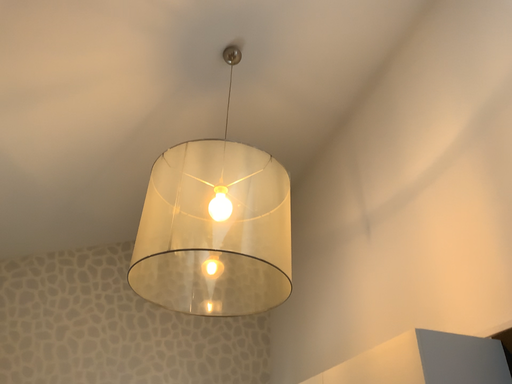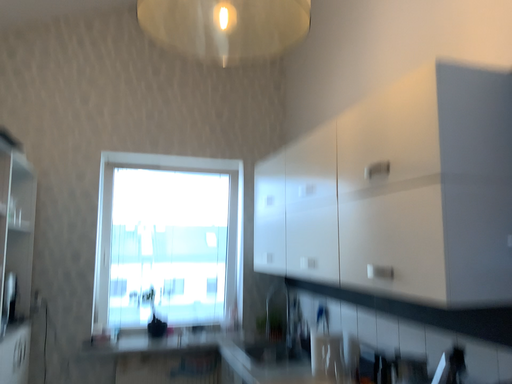
Question: How did the camera likely rotate when shooting the video?

Choices:
 (A) rotated downward
 (B) rotated upward

Answer: (A)